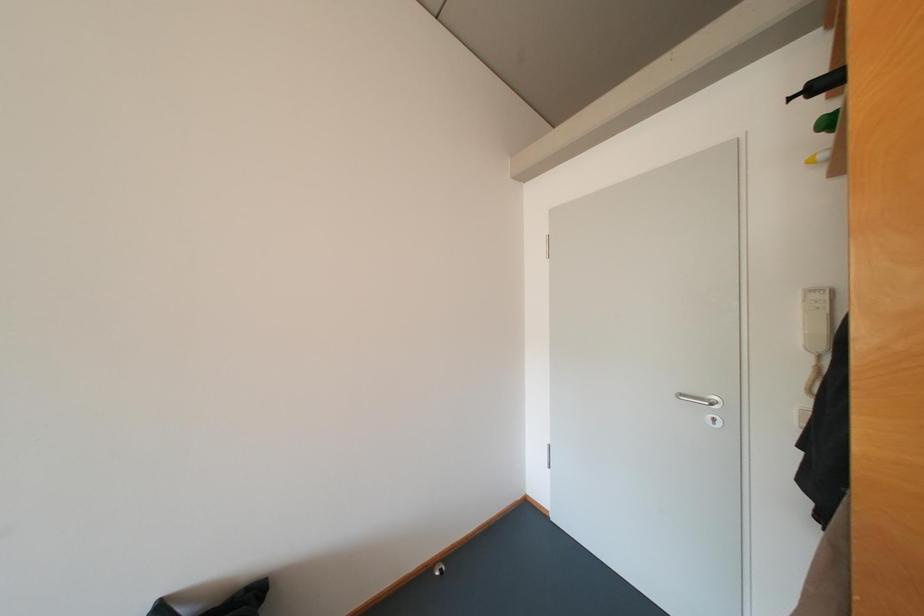
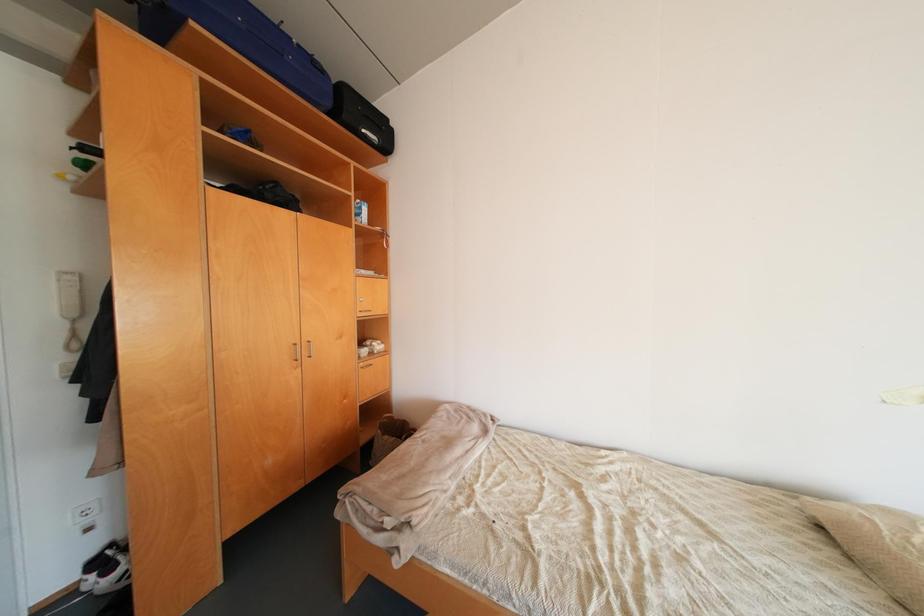
Question: The camera is either moving clockwise (left) or counter-clockwise (right) around the object. The first image is from the beginning of the video and the second image is from the end. Is the camera moving left or right when shooting the video?

Choices:
 (A) Left
 (B) Right

Answer: (A)